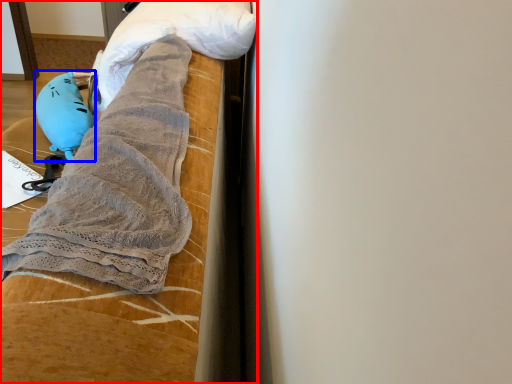
Question: Which of the following is the farthest to the observer, furniture (highlighted by a red box) or toy (highlighted by a blue box)?

Choices:
 (A) furniture
 (B) toy

Answer: (B)